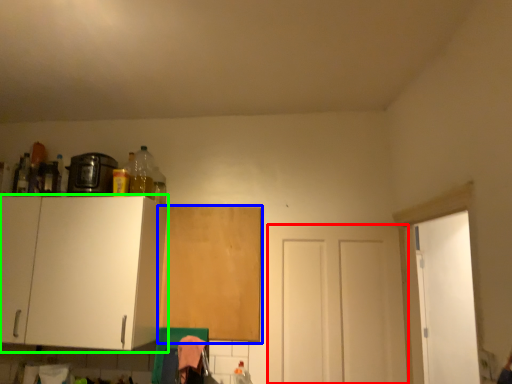
Question: Estimate the real-world distances between objects in this image. Which object is closer to door (highlighted by a red box), cabinetry (highlighted by a blue box) or cabinetry (highlighted by a green box)?

Choices:
 (A) cabinetry
 (B) cabinetry

Answer: (A)